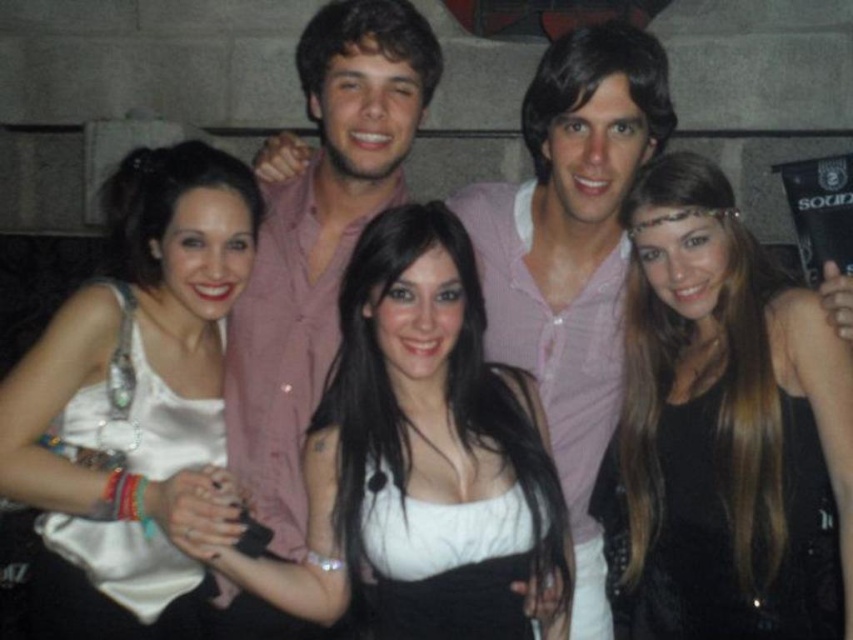
Question: Which of the following is the closest to the observer?

Choices:
 (A) (840, 385)
 (B) (93, 326)

Answer: (A)

Question: Is the position of black leather dress at center more distant than that of white satin dress at center?

Choices:
 (A) yes
 (B) no

Answer: (B)

Question: Is the position of white satin dress at center more distant than that of white satin tank top at center?

Choices:
 (A) yes
 (B) no

Answer: (A)

Question: Which object is positioned closest to the white satin dress at center?

Choices:
 (A) white satin tank top at center
 (B) black leather dress at center

Answer: (A)

Question: Which point is closer to the camera?

Choices:
 (A) black leather dress at center
 (B) white satin dress at center
 (C) white satin tank top at center

Answer: (A)

Question: Considering the relative positions of black leather dress at center and white satin dress at center in the image provided, where is black leather dress at center located with respect to white satin dress at center?

Choices:
 (A) below
 (B) above

Answer: (B)